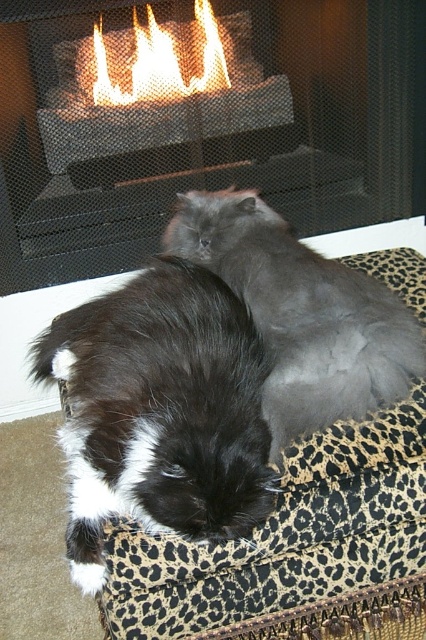
Question: Considering the real-world distances, which object is closest to the gray fluffy cat at center?

Choices:
 (A) metallic mesh fireplace at center
 (B) leopard print cushion at center

Answer: (B)

Question: Can you confirm if metallic mesh fireplace at center is wider than leopard print cushion at center?

Choices:
 (A) yes
 (B) no

Answer: (A)

Question: Does leopard print cushion at center lie in front of gray fluffy cat at center?

Choices:
 (A) no
 (B) yes

Answer: (B)

Question: Considering the relative positions of metallic mesh fireplace at center and gray fluffy cat at center in the image provided, where is metallic mesh fireplace at center located with respect to gray fluffy cat at center?

Choices:
 (A) above
 (B) below

Answer: (A)

Question: Which point is farther from the camera taking this photo?

Choices:
 (A) (141, 637)
 (B) (69, 353)
 (C) (40, 100)
 (D) (354, 368)

Answer: (C)

Question: Considering the real-world distances, which object is farthest from the gray fluffy cat at center?

Choices:
 (A) black fluffy cat at center
 (B) leopard print cushion at center
 (C) metallic mesh fireplace at center

Answer: (C)